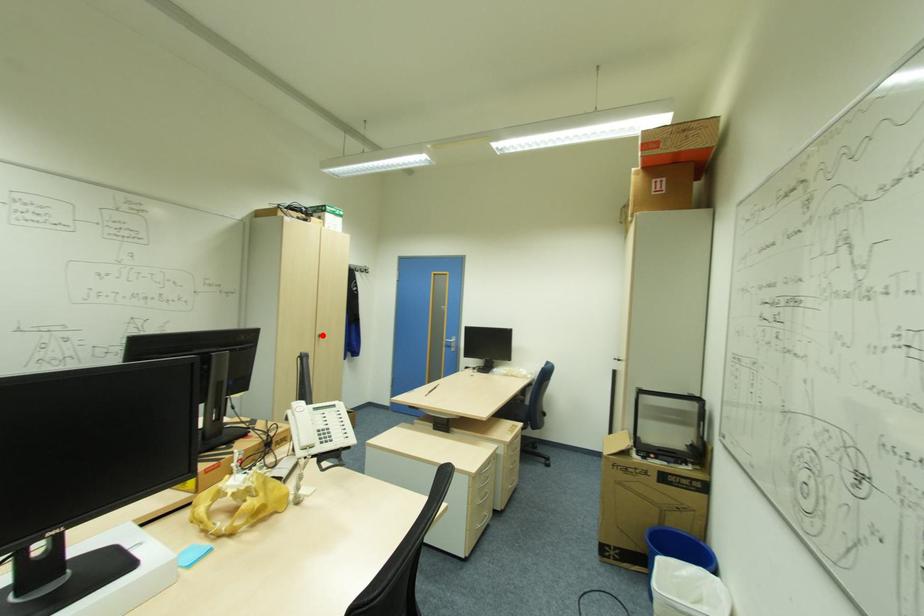
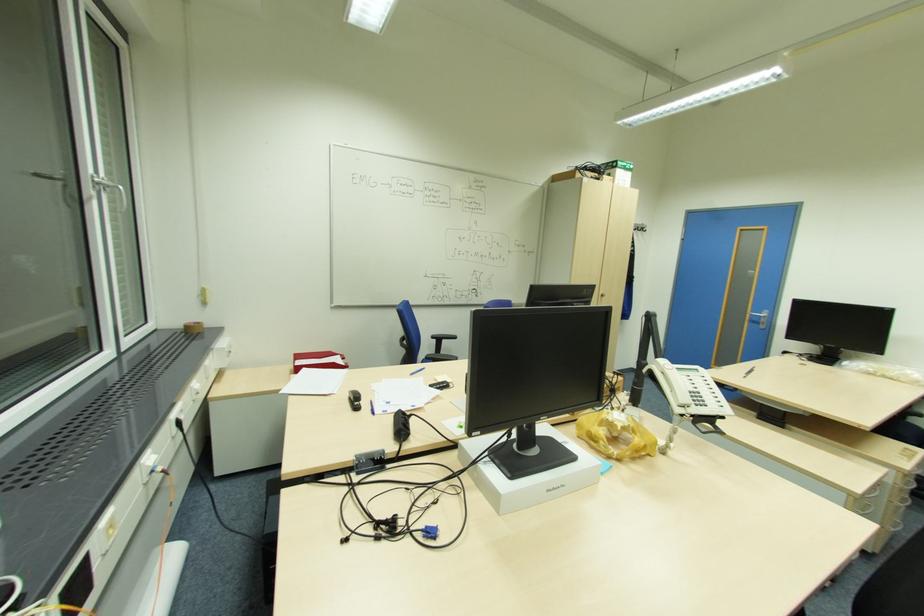
Locate, in the second image, the point that corresponds to the highlighted location in the first image.

(604, 294)